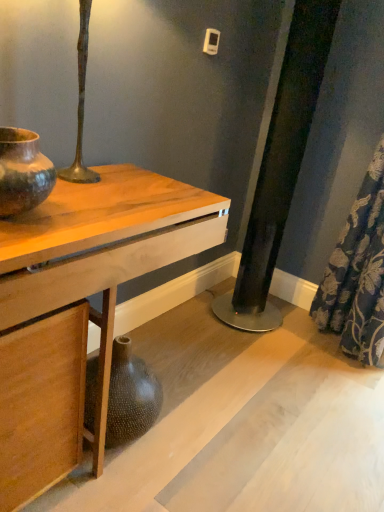
You are a GUI agent. You are given a task and a screenshot of the screen. Output one action in this format:
    pyautogui.click(x=<x>, y=<y>)
    Task: Click on the empty space that is in between wooden table at center and blue floral fabric at lower right
    
    Given the screenshot: What is the action you would take?
    pyautogui.click(x=236, y=380)